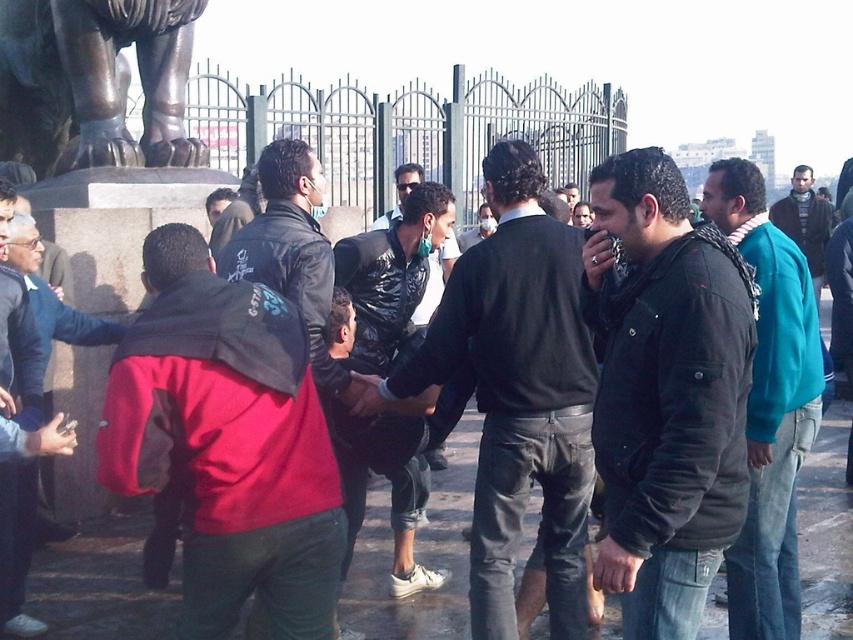
You are a photographer trying to capture both the red matte jacket at center and the black matte jacket at center in a single frame. Since you can only focus on one jacket at a time, which jacket should you focus on to ensure the other remains in the background?

You should focus on the red matte jacket at center because it is positioned to the left of the black matte jacket at center, so the black matte jacket at center will naturally appear in the background when the red one is in focus.

You are standing in the public square and see a group of people. There is a point marked at coordinates (666, 396). What object is located at that point?

The point at coordinates (666, 396) corresponds to the black matte jacket at center.